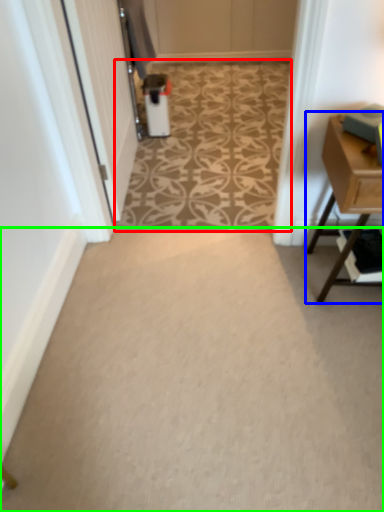
Question: Which object is positioned farthest from pattern (highlighted by a red box)? Select from table (highlighted by a blue box) and plain (highlighted by a green box).

Choices:
 (A) table
 (B) plain

Answer: (A)